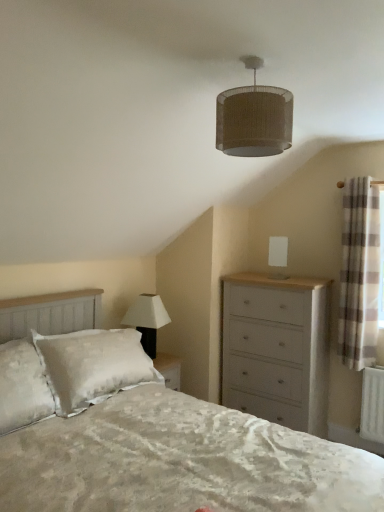
Where is `vacant area that is in front of white matte lampshade at upper center, which is the third lamp in front-to-back order`? This screenshot has width=384, height=512. vacant area that is in front of white matte lampshade at upper center, which is the third lamp in front-to-back order is located at coordinates (291, 281).